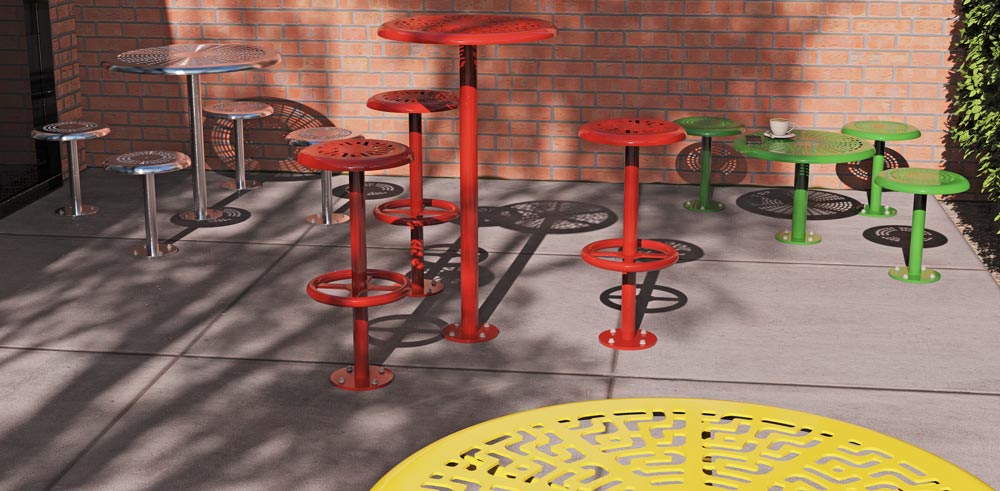
Locate an element on the screen. This screenshot has height=491, width=1000. red circle seating is located at coordinates (365, 165), (421, 104), (634, 144).